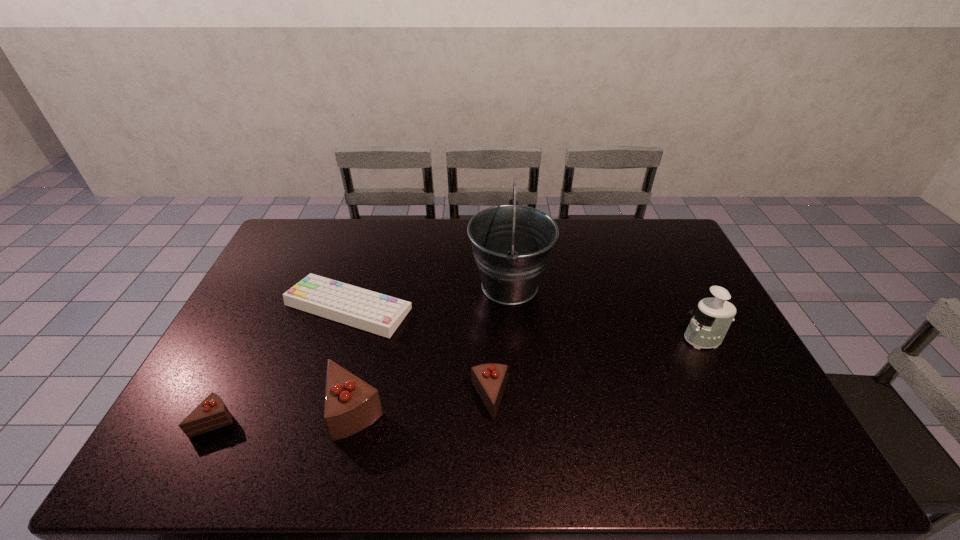
What are the coordinates of `free space that is in between the second chocolate cake from left to right and the leftmost chocolate cake` in the screenshot? It's located at (285, 416).

At what (x,y) coordinates should I click in order to perform the action: click on vacant region between the bucket and the third tallest object. Please return your answer as a coordinate pair (x, y). Looking at the image, I should click on (433, 348).

Locate an element on the screen. free space between the computer keyboard and the bucket is located at coordinates (429, 296).

You are a GUI agent. You are given a task and a screenshot of the screen. Output one action in this format:
    pyautogui.click(x=<x>, y=<y>)
    Task: Click on the free space between the fifth tallest object and the computer keyboard
    
    Given the screenshot: What is the action you would take?
    pyautogui.click(x=282, y=364)

Image resolution: width=960 pixels, height=540 pixels. Find the location of `free space between the tallest chocolate cake and the rightmost object`. free space between the tallest chocolate cake and the rightmost object is located at coordinates (529, 375).

Locate an element on the screen. This screenshot has height=540, width=960. the fourth closest object to the leftmost chocolate cake is located at coordinates (512, 244).

The width and height of the screenshot is (960, 540). Find the location of `the fifth closest object to the juicer`. the fifth closest object to the juicer is located at coordinates (211, 414).

The width and height of the screenshot is (960, 540). I want to click on the second closest chocolate cake relative to the juicer, so click(351, 404).

Locate an element on the screen. This screenshot has height=540, width=960. chocolate cake that is the closest one to the shortest object is located at coordinates (351, 404).

Locate an element on the screen. vacant space that satisfies the following two spatial constraints: 1. on the back side of the fourth tallest object; 2. on the right side of the bucket is located at coordinates point(488,286).